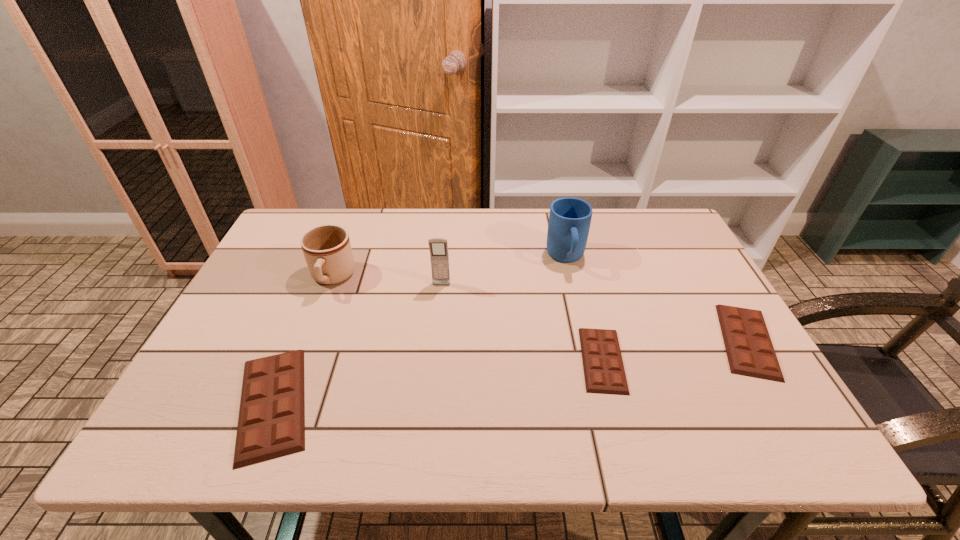
The width and height of the screenshot is (960, 540). I want to click on vacant area that lies between the leftmost chocolate bar and the taller mug, so click(x=420, y=330).

At what (x,y) coordinates should I click in order to perform the action: click on vacant area between the left mug and the leftmost chocolate bar. Please return your answer as a coordinate pair (x, y). Looking at the image, I should click on (302, 341).

In order to click on free space between the cellular telephone and the leftmost chocolate bar in this screenshot , I will do `click(357, 344)`.

Identify the location of free space between the third object from left to right and the second shortest chocolate bar. (594, 313).

At what (x,y) coordinates should I click in order to perform the action: click on vacant space that's between the right mug and the second shortest chocolate bar. Please return your answer as a coordinate pair (x, y). This screenshot has width=960, height=540. Looking at the image, I should click on (657, 300).

The image size is (960, 540). What are the coordinates of `object that can be found as the second closest to the leftmost chocolate bar` in the screenshot? It's located at (438, 247).

Locate an element on the screen. The height and width of the screenshot is (540, 960). object that is the fifth nearest to the shorter mug is located at coordinates (750, 352).

Locate which chocolate bar ranks in proximity to the cellular telephone. Please provide its 2D coordinates. Your answer should be formatted as a tuple, i.e. [(x, y)], where the tuple contains the x and y coordinates of a point satisfying the conditions above.

[(271, 424)]

Identify the location of the second closest chocolate bar to the second chocolate bar from right to left. (271, 424).

Identify the location of free spot that satisfies the following two spatial constraints: 1. on the side of the second shortest chocolate bar with the handle; 2. on the right side of the third tallest object. Image resolution: width=960 pixels, height=540 pixels. (308, 341).